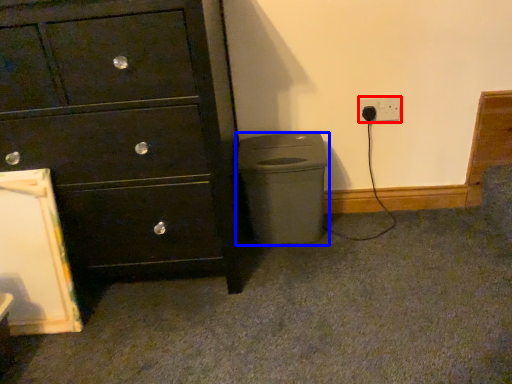
Question: Which of the following is the closest to the observer, power plugs and sockets (highlighted by a red box) or waste container (highlighted by a blue box)?

Choices:
 (A) power plugs and sockets
 (B) waste container

Answer: (B)